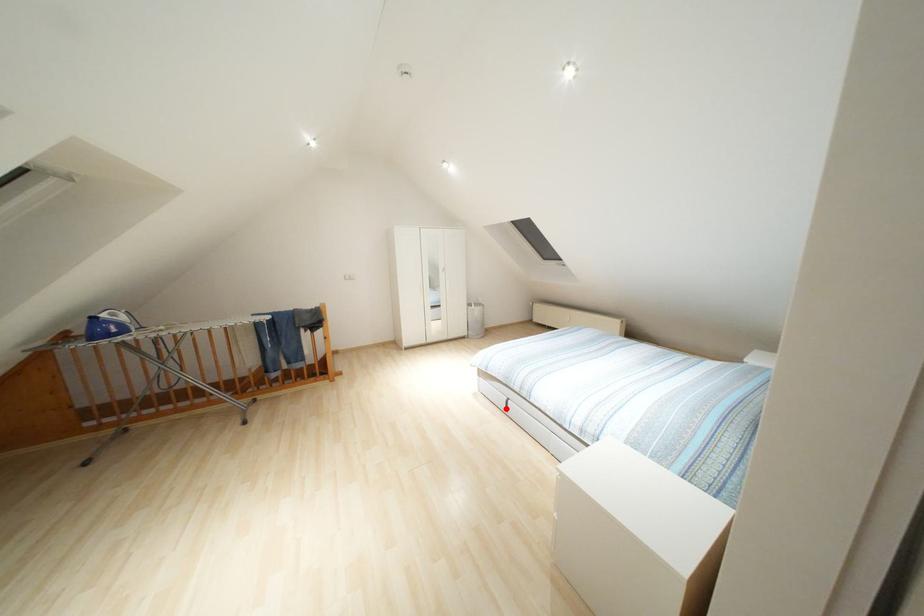
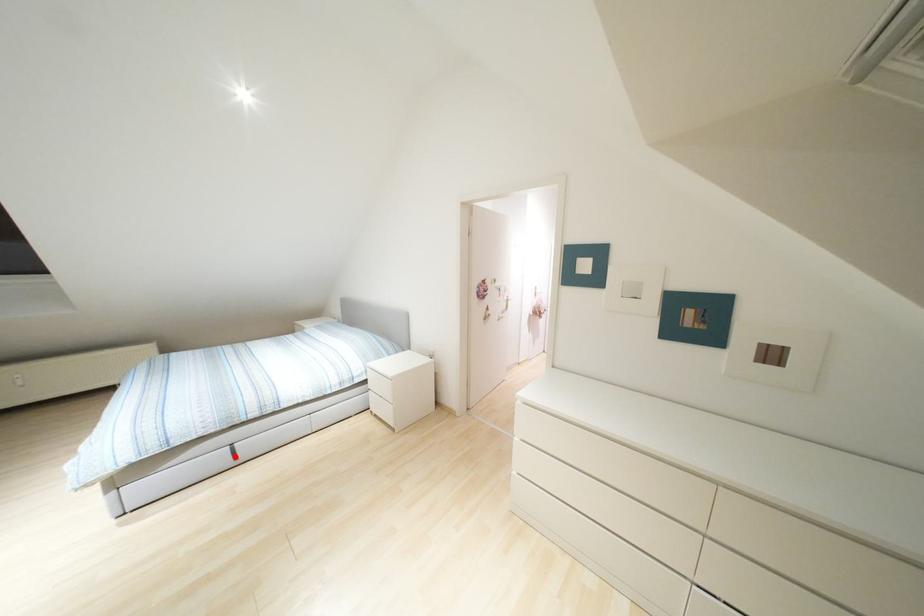
I am providing you with two images of the same scene from different viewpoints. A red point is marked on the first image and another point is marked on the second image. Are the points marked in image1 and image2 representing the same 3D position?

Yes